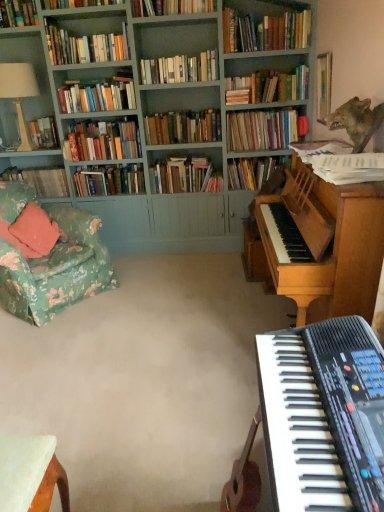
Where is `vacant area that is situated to the right of floral fabric chair at left`? The image size is (384, 512). vacant area that is situated to the right of floral fabric chair at left is located at coordinates (150, 295).